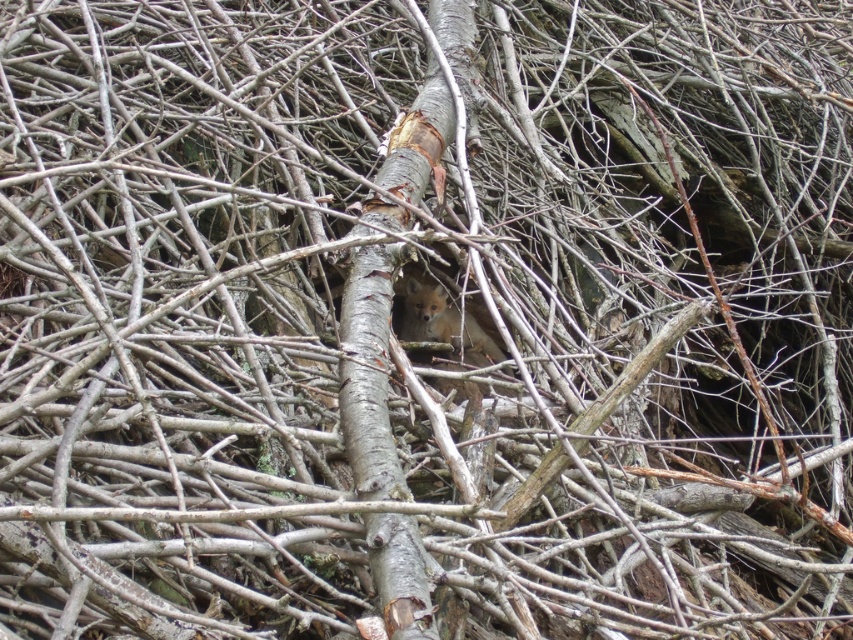
Question: Is gray bark tree trunk at center below fluffy reddish-brown fox at center?

Choices:
 (A) yes
 (B) no

Answer: (B)

Question: Does gray bark tree trunk at center appear on the right side of fluffy reddish-brown fox at center?

Choices:
 (A) no
 (B) yes

Answer: (A)

Question: Which of the following is the closest to the observer?

Choices:
 (A) (404, 195)
 (B) (450, 320)

Answer: (A)

Question: From the image, what is the correct spatial relationship of gray bark tree trunk at center in relation to fluffy reddish-brown fox at center?

Choices:
 (A) above
 (B) below

Answer: (A)